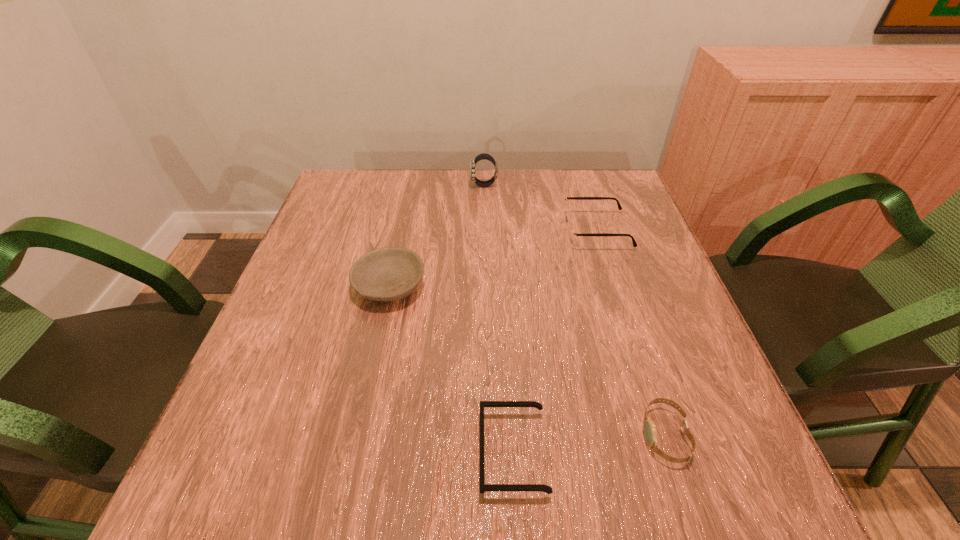
Where is `free location located on the front-facing side of the shortest object`? This screenshot has height=540, width=960. free location located on the front-facing side of the shortest object is located at coordinates (417, 453).

Identify the location of watch at the far edge. This screenshot has width=960, height=540. pos(485,156).

This screenshot has width=960, height=540. I want to click on spectacles positioned at the far edge, so click(572, 234).

The width and height of the screenshot is (960, 540). What are the coordinates of `watch that is at the near edge` in the screenshot? It's located at (649, 428).

Locate an element on the screen. The height and width of the screenshot is (540, 960). sunglasses that is at the near edge is located at coordinates (484, 487).

The image size is (960, 540). In order to click on object located in the left edge section of the desktop in this screenshot , I will do `click(386, 274)`.

At what (x,y) coordinates should I click in order to perform the action: click on spectacles located in the right edge section of the desktop. Please return your answer as a coordinate pair (x, y). Image resolution: width=960 pixels, height=540 pixels. Looking at the image, I should click on pos(572,234).

Where is `watch that is at the right edge`? watch that is at the right edge is located at coordinates (649, 428).

Where is `object positioned at the far right corner`? object positioned at the far right corner is located at coordinates (572, 234).

Locate an element on the screen. The width and height of the screenshot is (960, 540). object situated at the near right corner is located at coordinates (649, 428).